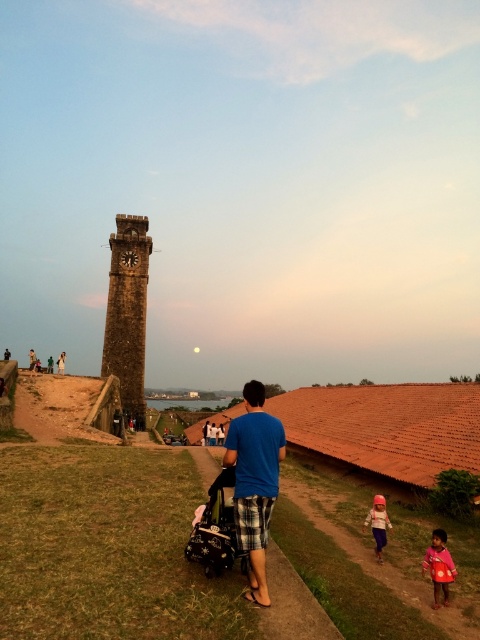
You are standing at the entrance of the clock tower and notice a person wearing a blue cotton shirt at center and blue plaid shorts at center. Based on their clothing items, can you determine which item is positioned lower on their body?

The blue cotton shirt at center is positioned below the blue plaid shorts at center, so the shirt is lower on the body.

You are standing at the entrance of the pathway leading to the stone clock tower at left and want to see the pink fabric child at lower right clearly. Which object is closer to you, and why?

The pink fabric child at lower right is closer to you because the stone clock tower at left is taller than the pink fabric child at lower right, implying that the child is positioned in the foreground while the tower is in the background.